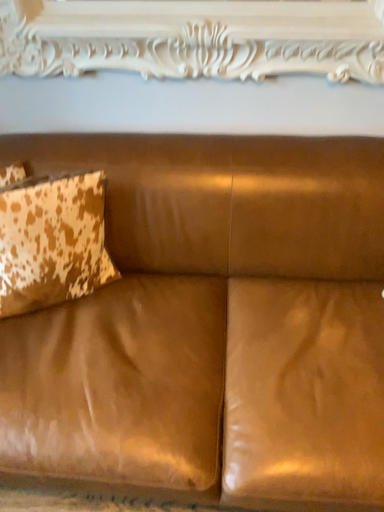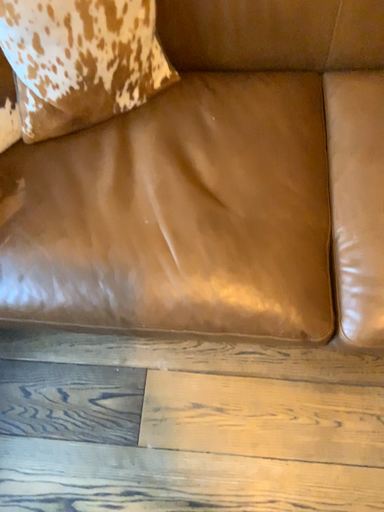
Question: Which way did the camera rotate in the video?

Choices:
 (A) rotated upward
 (B) rotated downward

Answer: (B)